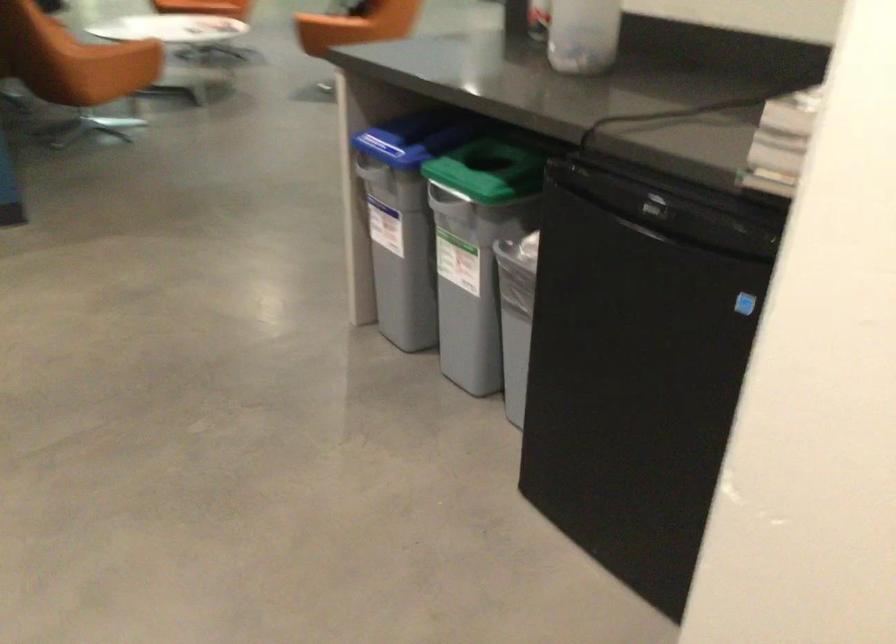
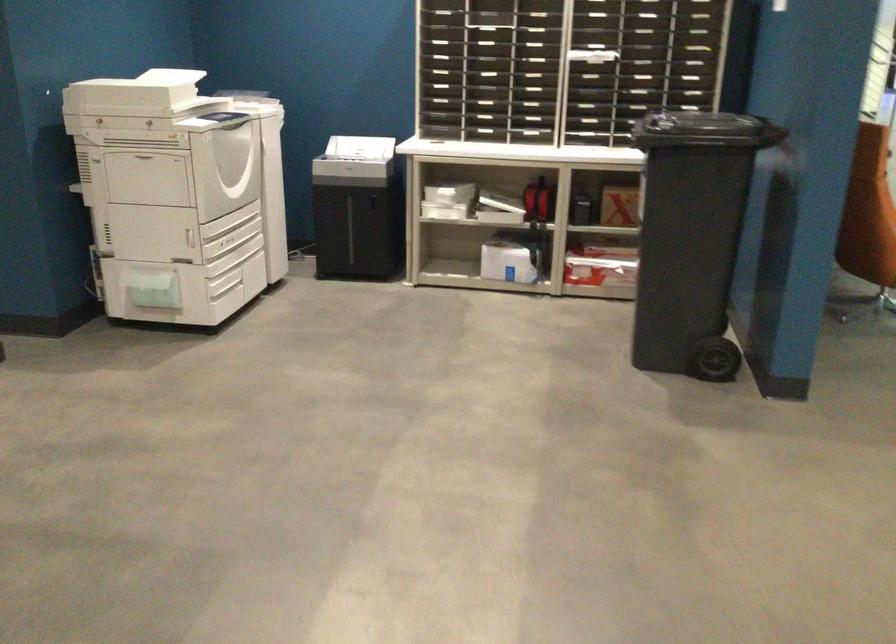
Question: How did the camera likely rotate?

Choices:
 (A) Left
 (B) Right
 (C) Up
 (D) Down

Answer: (A)